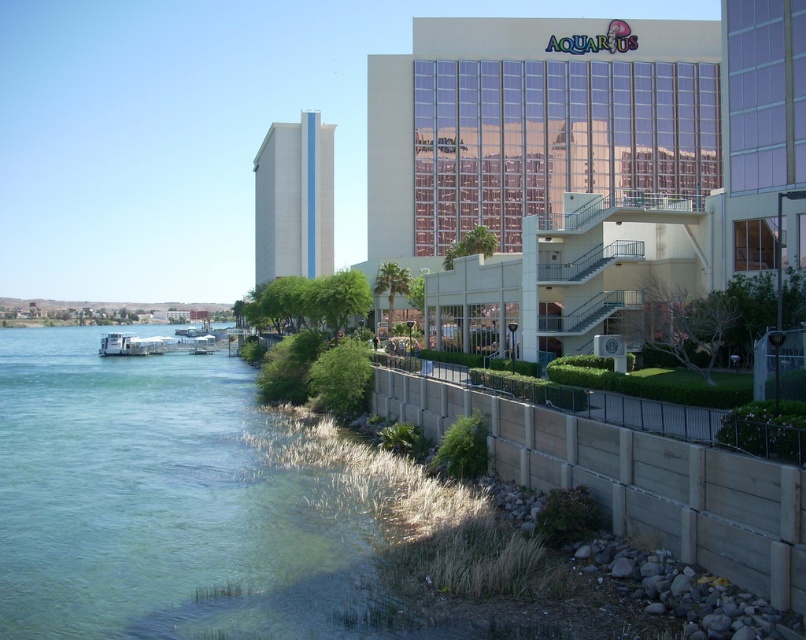
You are standing at the waterfront near the Aquarius building. You see a clear water at lower left and a white matte boat at lower left. Which object is positioned to the right side?

The clear water at lower left is to the right of the white matte boat at lower left.

You are standing at the waterfront and want to walk from the clear water at lower left to the glassy reflective building at upper center. Which direction should you move to reach the building?

You should move to the right because the clear water at lower left is to the left of the glassy reflective building at upper center, so moving right will bring you closer to the building.

You are standing at the origin point of the image. Which direction should you move to reach the clear water at lower left?

The clear water at lower left is located at coordinates point (171, 504), so you should move towards the lower left direction to reach it.